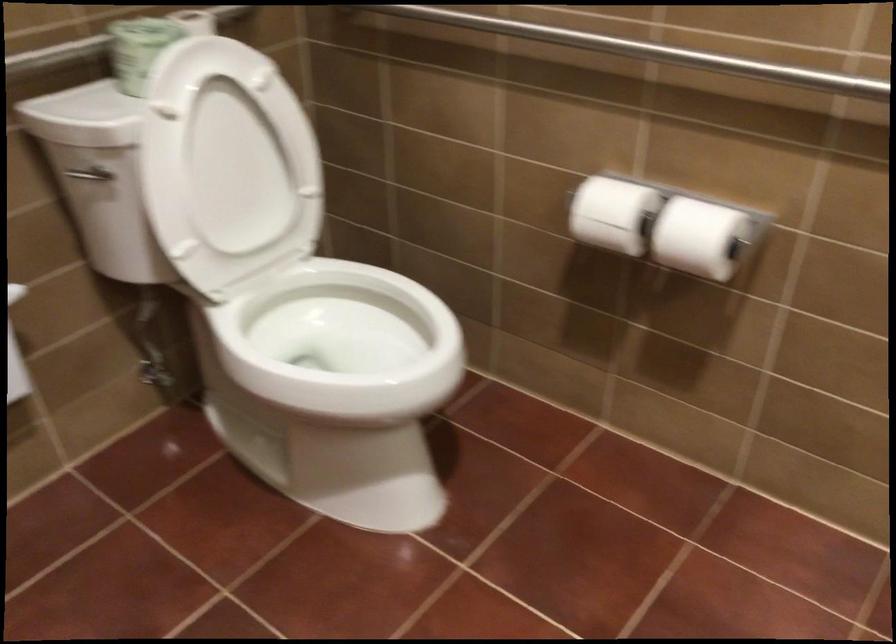
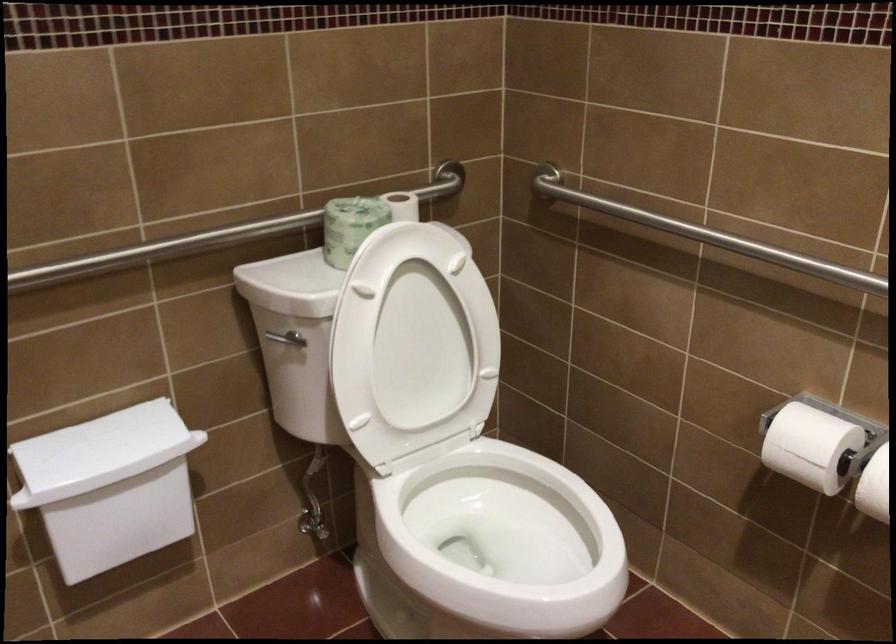
Where in the second image is the point corresponding to pixel 607 213 from the first image?

(810, 446)